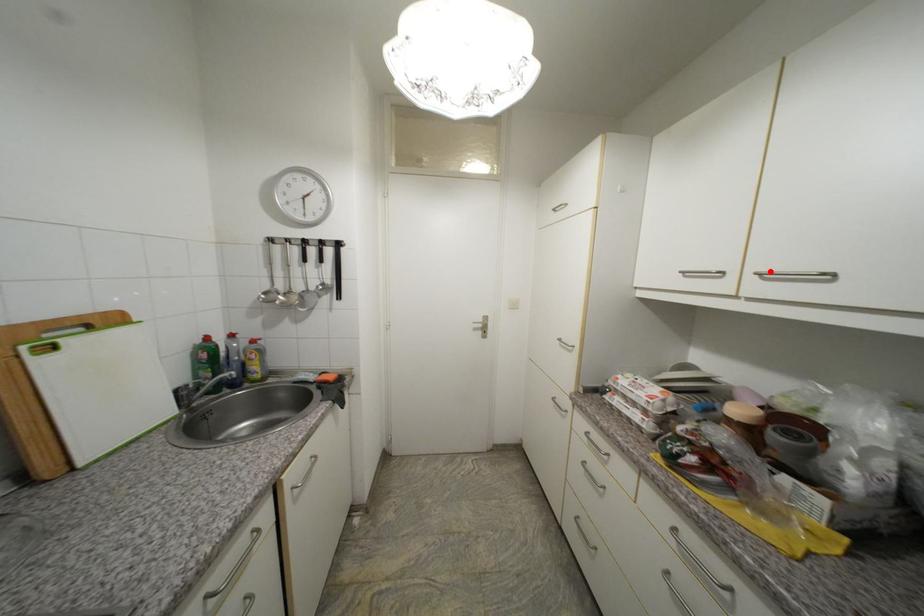
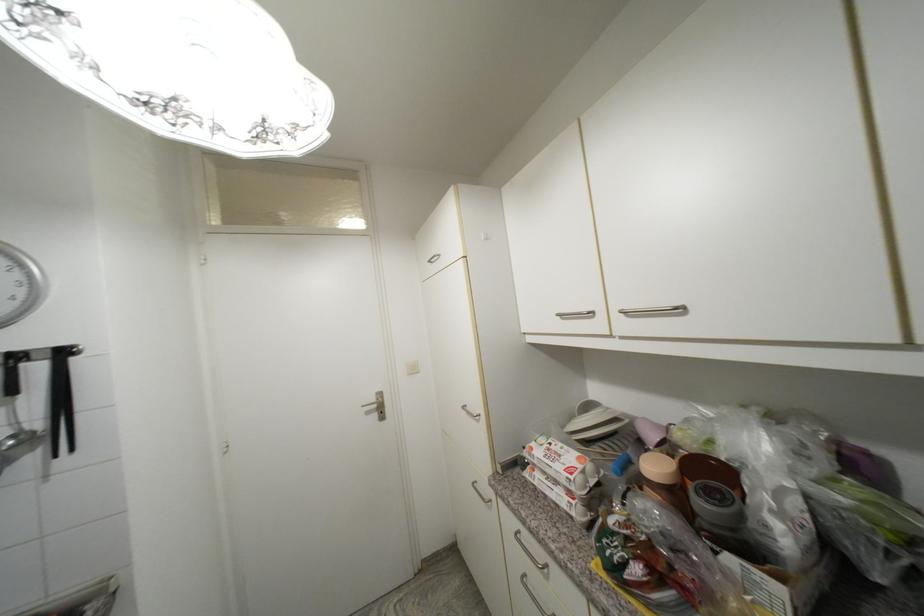
Locate, in the second image, the point that corresponds to the highlighted location in the first image.

(631, 309)